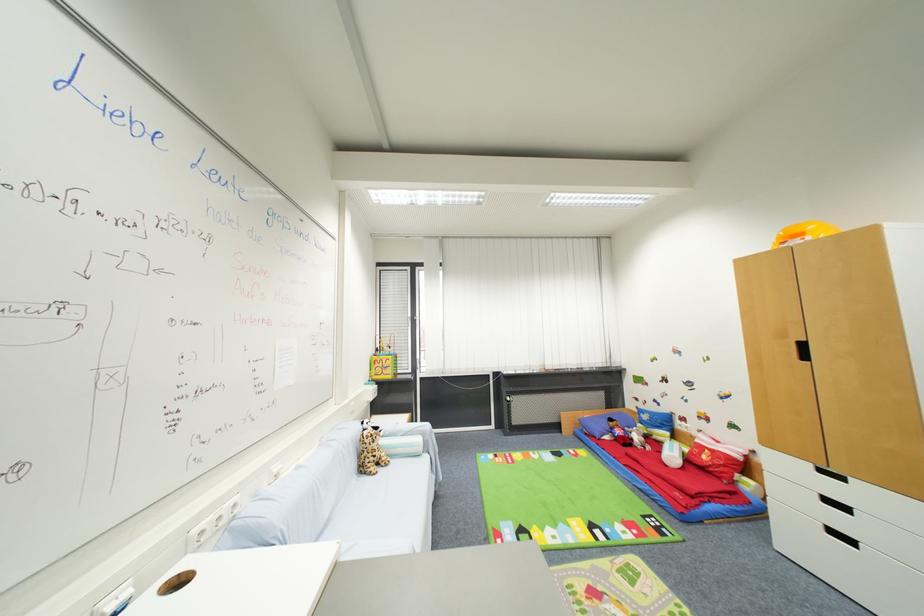
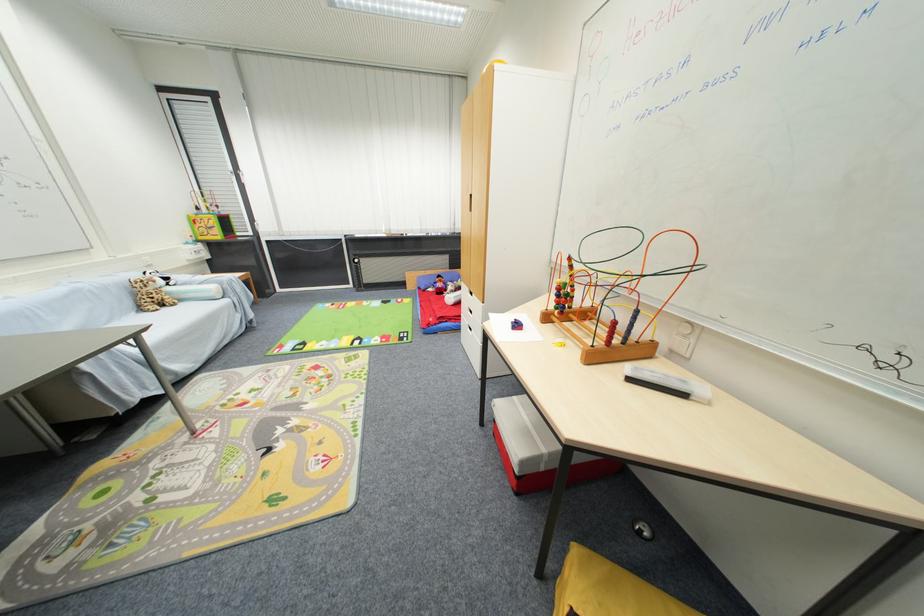
Question: I am providing you with two images of the same scene from different viewpoints. After the viewpoint changes to image2, which objects are now occluded?

Choices:
 (A) silver pump bottle
 (B) white drawer handle
 (C) sofa sitting surface
 (D) whiteboard eraser

Answer: (B)